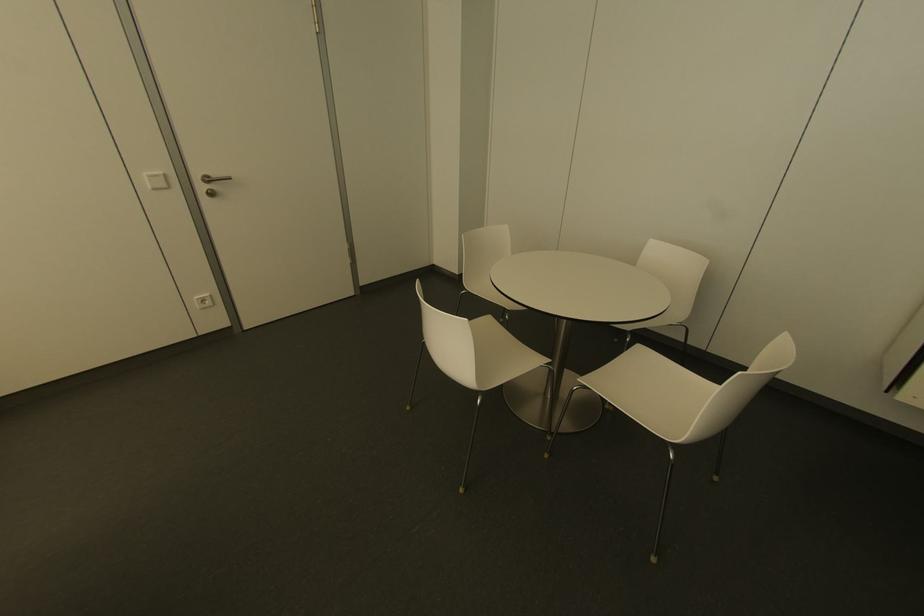
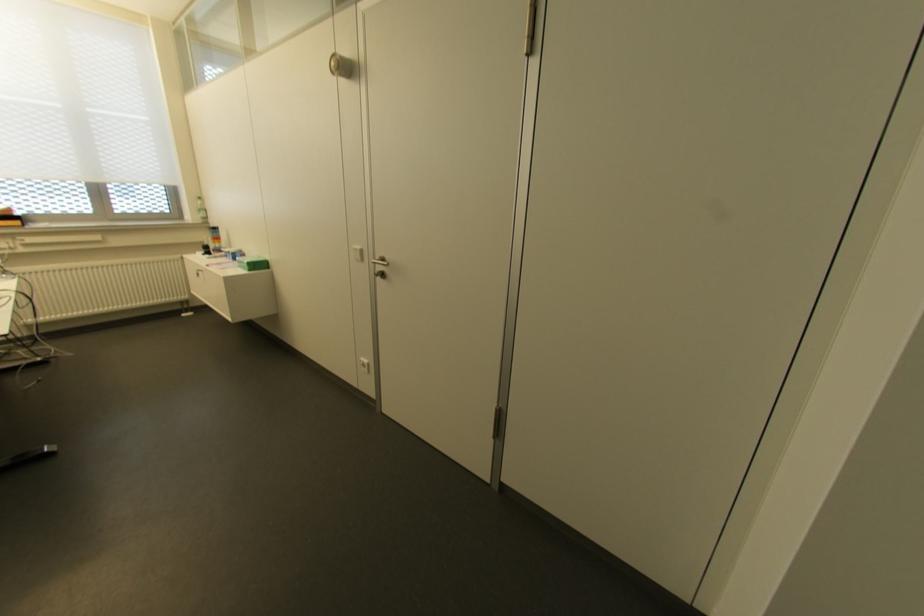
Where in the second image is the point corresponding to (x=159, y=172) from the first image?

(358, 246)